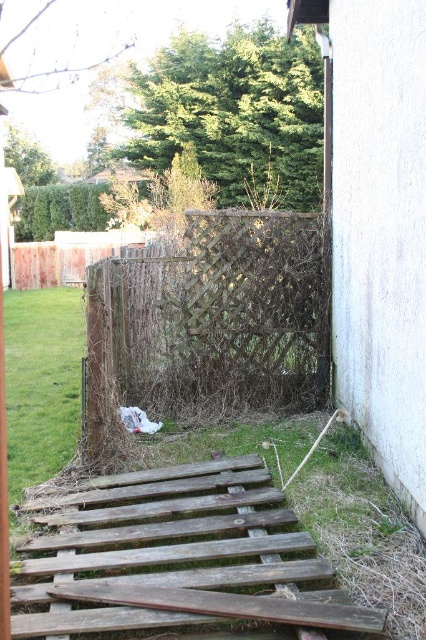
Question: Is brown woven fence at center positioned before green grass at lower left?

Choices:
 (A) yes
 (B) no

Answer: (B)

Question: Is brown woven fence at center positioned in front of green grass at lower left?

Choices:
 (A) yes
 (B) no

Answer: (B)

Question: Does brown woven fence at center appear over green grass at lower left?

Choices:
 (A) yes
 (B) no

Answer: (A)